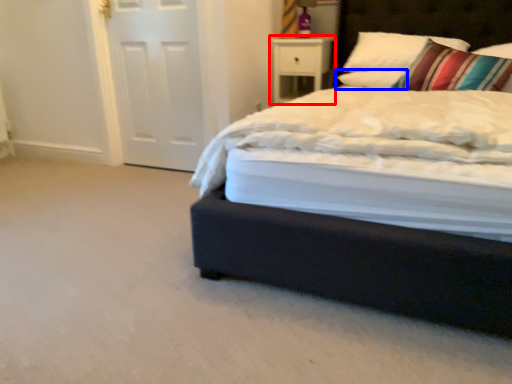
Question: Which of the following is the closest to the observer, nightstand (highlighted by a red box) or pillow (highlighted by a blue box)?

Choices:
 (A) nightstand
 (B) pillow

Answer: (B)